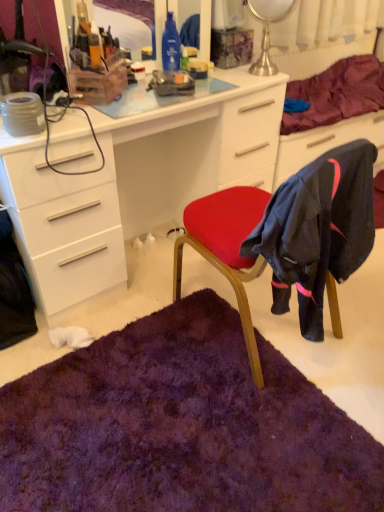
Locate an element on the screen. This screenshot has height=512, width=384. free spot in front of metallic silver table lamp at upper center is located at coordinates (256, 80).